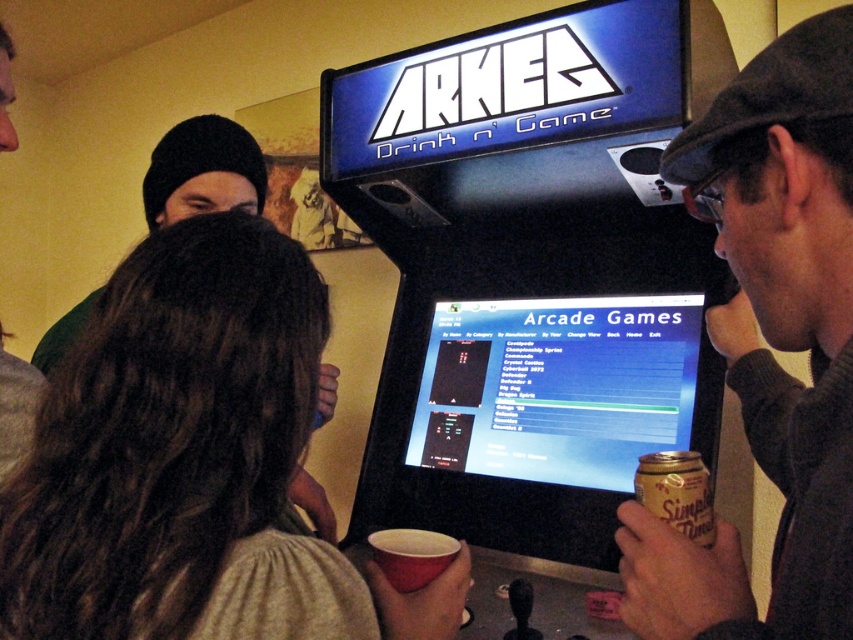
Does shiny plastic screen at center have a lesser width compared to matte red cup at lower center?

No, shiny plastic screen at center is not thinner than matte red cup at lower center.

Is shiny plastic screen at center below matte red cup at lower center?

No.

The width and height of the screenshot is (853, 640). Find the location of `shiny plastic screen at center`. shiny plastic screen at center is located at coordinates (556, 387).

Which is behind, point (614, 468) or point (688, 522)?

Positioned behind is point (614, 468).

Measure the distance between point (653, 403) and camera.

Point (653, 403) is 1.30 meters away from camera.

The height and width of the screenshot is (640, 853). Find the location of `shiny plastic screen at center`. shiny plastic screen at center is located at coordinates (556, 387).

The width and height of the screenshot is (853, 640). What are the coordinates of `shiny plastic screen at center` in the screenshot? It's located at [x=556, y=387].

Between smooth beige sweater at center and dark gray wool cap at upper right, which one appears on the left side from the viewer's perspective?

Positioned to the left is smooth beige sweater at center.

Does smooth beige sweater at center have a greater height compared to dark gray wool cap at upper right?

No.

The image size is (853, 640). What do you see at coordinates (163, 435) in the screenshot?
I see `smooth beige sweater at center` at bounding box center [163, 435].

The width and height of the screenshot is (853, 640). In order to click on smooth beige sweater at center in this screenshot , I will do `click(163, 435)`.